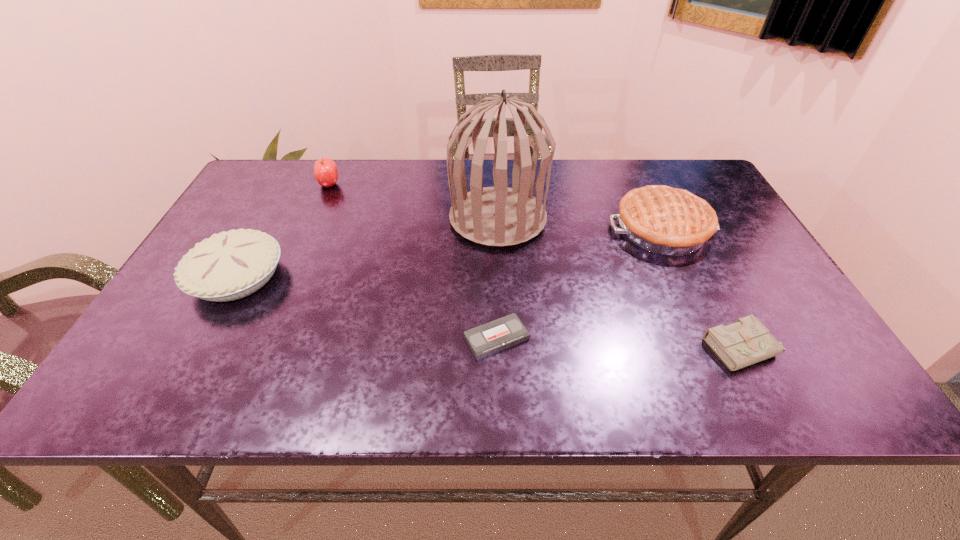
This screenshot has height=540, width=960. I want to click on vacant area situated on the back of the diary, so click(682, 225).

What are the coordinates of `vacant space situated on the right of the videotape` in the screenshot? It's located at (693, 338).

Locate an element on the screen. The height and width of the screenshot is (540, 960). birdcage located at the far edge is located at coordinates (499, 216).

Where is `pie located in the far edge section of the desktop`? This screenshot has height=540, width=960. pie located in the far edge section of the desktop is located at coordinates (669, 221).

Locate an element on the screen. Image resolution: width=960 pixels, height=540 pixels. apple positioned at the far edge is located at coordinates (325, 170).

Locate an element on the screen. object that is at the near edge is located at coordinates (747, 341).

At what (x,y) coordinates should I click in order to perform the action: click on object at the left edge. Please return your answer as a coordinate pair (x, y). Looking at the image, I should click on (231, 265).

Identify the location of pie at the right edge. (669, 221).

Where is `diary that is at the right edge`? diary that is at the right edge is located at coordinates (747, 341).

Identify the location of object located in the far right corner section of the desktop. This screenshot has height=540, width=960. (669, 221).